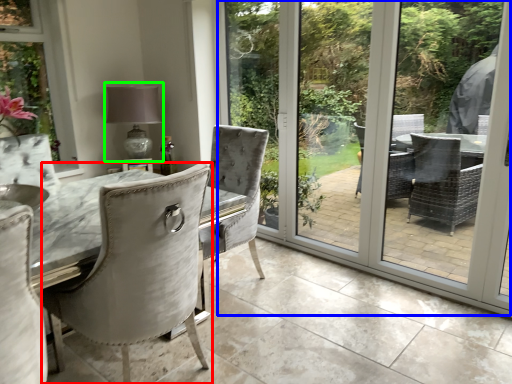
Question: Considering the real-world distances, which object is farthest from chair (highlighted by a red box)? screen door (highlighted by a blue box) or table lamp (highlighted by a green box)?

Choices:
 (A) screen door
 (B) table lamp

Answer: (A)